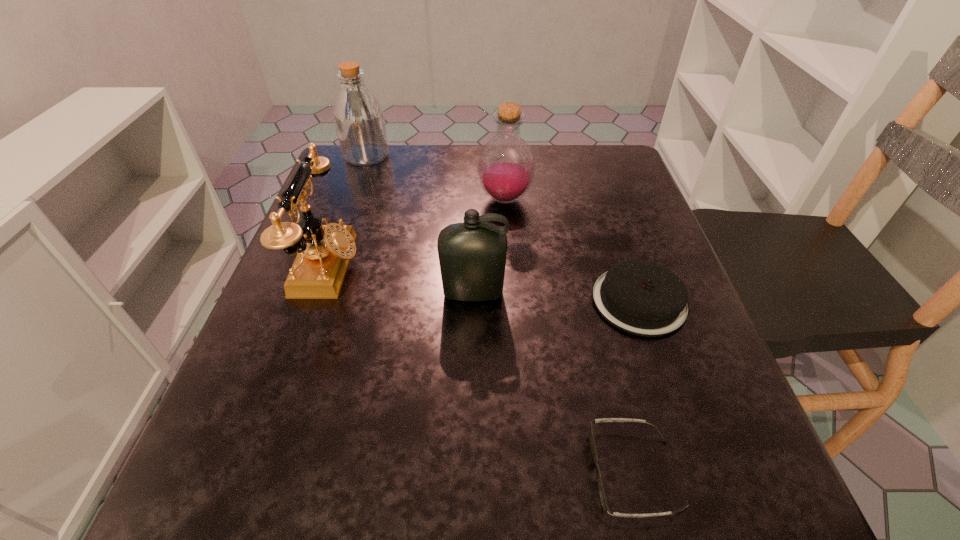
What are the coordinates of `vacant region between the shortest object and the second farthest bottle` in the screenshot? It's located at (570, 336).

Where is `free spot between the shortest bottle and the farthest object`? free spot between the shortest bottle and the farthest object is located at coordinates (420, 224).

This screenshot has width=960, height=540. In order to click on free space between the telephone and the leftmost bottle in this screenshot , I will do `click(348, 211)`.

Image resolution: width=960 pixels, height=540 pixels. I want to click on vacant area that lies between the fifth nearest object and the telephone, so click(x=417, y=233).

The width and height of the screenshot is (960, 540). Identify the location of empty space between the second farthest object and the second shortest object. (572, 250).

This screenshot has height=540, width=960. I want to click on vacant area that lies between the leftmost bottle and the telephone, so click(348, 211).

Identify the location of free point between the nearest bottle and the fifth tallest object. Image resolution: width=960 pixels, height=540 pixels. (556, 297).

Find the location of a particular element. The width and height of the screenshot is (960, 540). free space between the fifth nearest object and the second shortest object is located at coordinates (572, 250).

This screenshot has width=960, height=540. I want to click on free space between the shortest object and the farthest bottle, so click(x=501, y=314).

Identify the location of object that can be found as the fourth closest to the leftmost bottle. (640, 297).